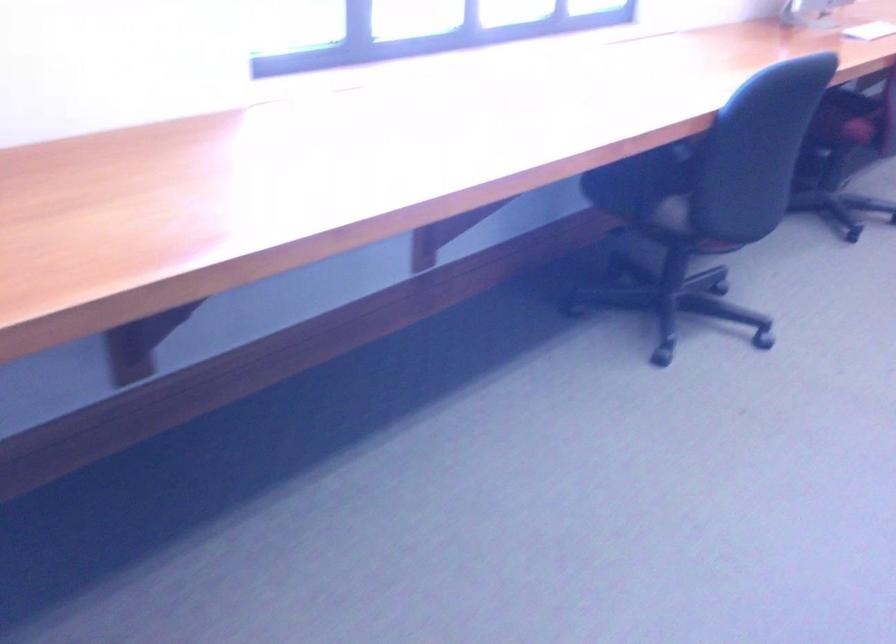
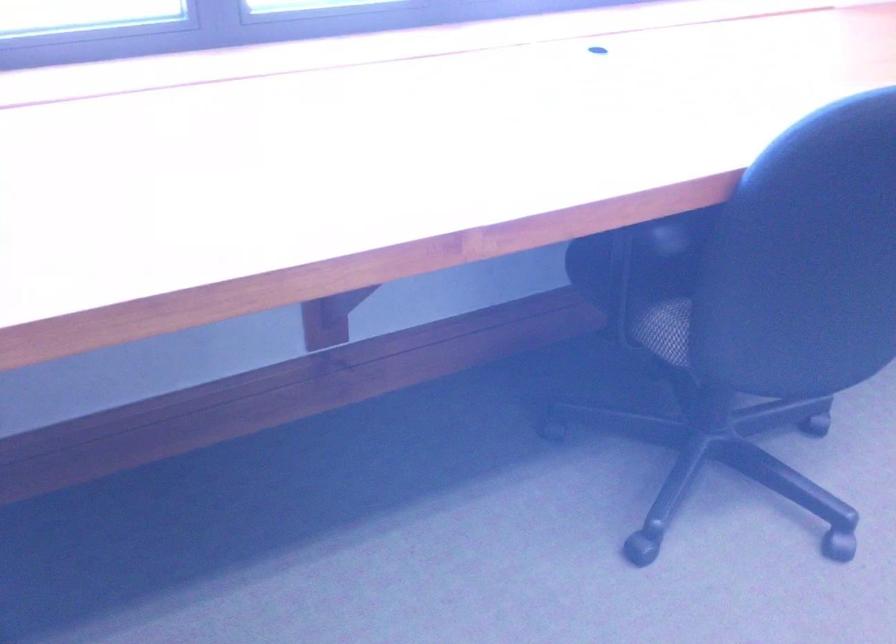
In the second image, find the point that corresponds to (x=647, y=185) in the first image.

(645, 279)